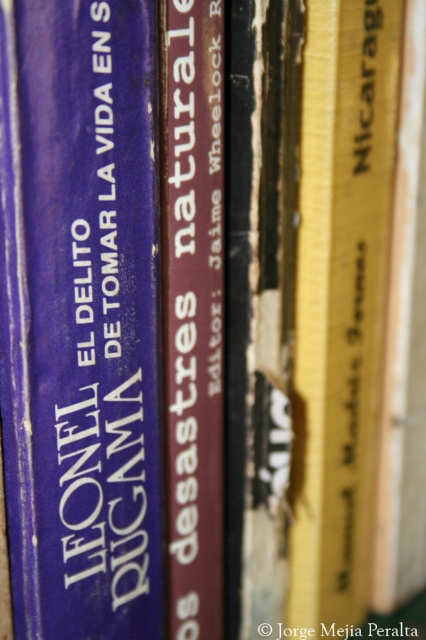
Is point (354, 500) positioned before point (193, 620)?

No, (354, 500) is further to viewer.

Who is more forward, [333,84] or [216,72]?

Point [216,72] is in front.

Who is more forward, (350, 557) or (173, 285)?

Point (173, 285) is in front.

At what (x,y) coordinates should I click in order to perform the action: click on yellow matte book at center. Please return your answer as a coordinate pair (x, y). Image resolution: width=426 pixels, height=640 pixels. Looking at the image, I should click on (339, 305).

What do you see at coordinates (80, 317) in the screenshot? The height and width of the screenshot is (640, 426). I see `matte blue book at center` at bounding box center [80, 317].

Does matte blue book at center appear on the left side of maroon leather book at center?

Yes, matte blue book at center is to the left of maroon leather book at center.

Between point (108, 10) and point (181, 244), which one is positioned behind?

Positioned behind is point (181, 244).

Image resolution: width=426 pixels, height=640 pixels. What are the coordinates of `matte blue book at center` in the screenshot? It's located at (80, 317).

Between matte blue book at center and yellow matte book at center, which one has more height?

With more height is yellow matte book at center.

Find the location of a particular element. The width and height of the screenshot is (426, 640). matte blue book at center is located at coordinates (80, 317).